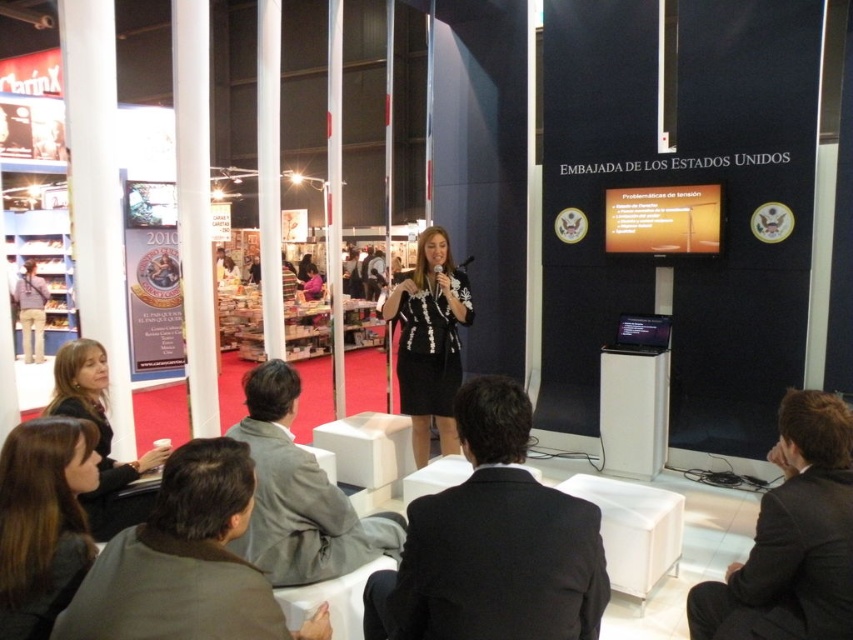
Can you confirm if black suit at center is taller than dark brown hair at lower left?

Yes, black suit at center is taller than dark brown hair at lower left.

Can you confirm if black suit at center is smaller than dark brown hair at lower left?

No.

Which is in front, point (465, 620) or point (33, 531)?

Point (465, 620) is in front.

Find the location of a particular element. black suit at center is located at coordinates (492, 544).

Which is more to the right, black satin dress at center or matte black jacket at lower left?

Positioned to the right is black satin dress at center.

Is point (469, 323) positioned in front of point (132, 468)?

No, (469, 323) is further to viewer.

Identify the location of black satin dress at center. The width and height of the screenshot is (853, 640). (430, 340).

Is point (91, 516) positioned in front of point (36, 339)?

That is True.

You are a GUI agent. You are given a task and a screenshot of the screen. Output one action in this format:
    pyautogui.click(x=<x>, y=<y>)
    Task: Click on the matte black jacket at lower left
    
    Given the screenshot: What is the action you would take?
    pos(99,436)